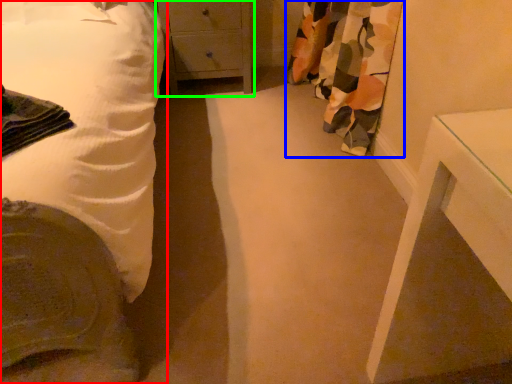
Question: Estimate the real-world distances between objects in this image. Which object is closer to bed (highlighted by a red box), curtain (highlighted by a blue box) or chest of drawers (highlighted by a green box)?

Choices:
 (A) curtain
 (B) chest of drawers

Answer: (B)